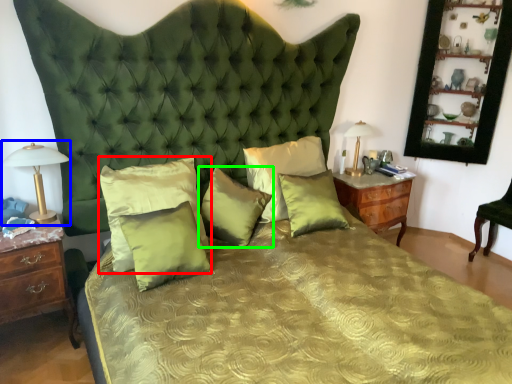
Question: Which object is the farthest from pillow (highlighted by a red box)? Choose among these: bedside lamp (highlighted by a blue box) or pillow (highlighted by a green box).

Choices:
 (A) bedside lamp
 (B) pillow

Answer: (A)